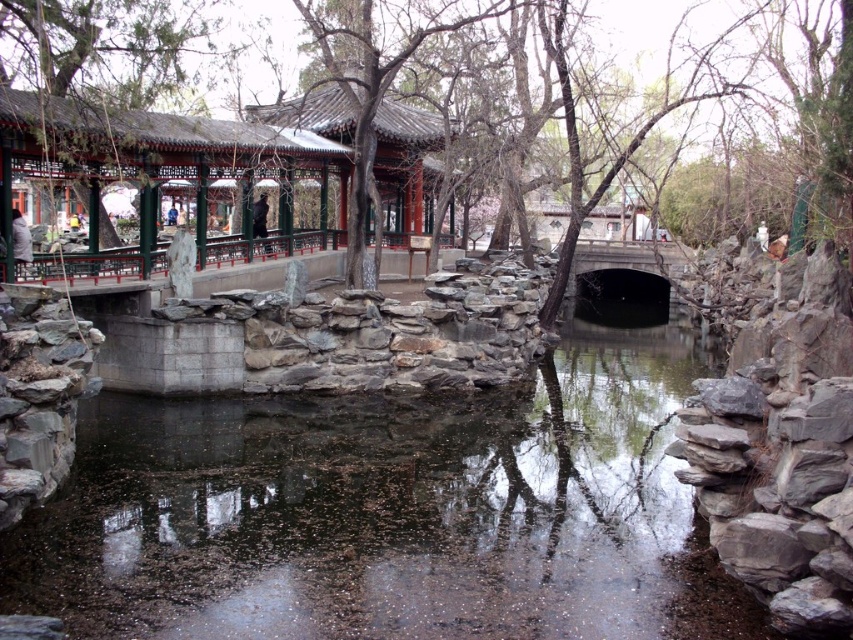
You are a visitor in the garden and want to take a photo of both the matte red wood pavilion at upper left and the smooth bark tree at center. Which object should you frame first in your camera to ensure both are in the shot?

You should frame the matte red wood pavilion at upper left first since it is positioned on the left side of the smooth bark tree at center, ensuring both are captured in the shot.

You are standing in the garden and want to take a photo of the transparent water at center and the matte red wood pavilion at upper left. Which object will appear larger in your photo?

The transparent water at center will appear larger in your photo because it is closer to the viewer than the matte red wood pavilion at upper left.